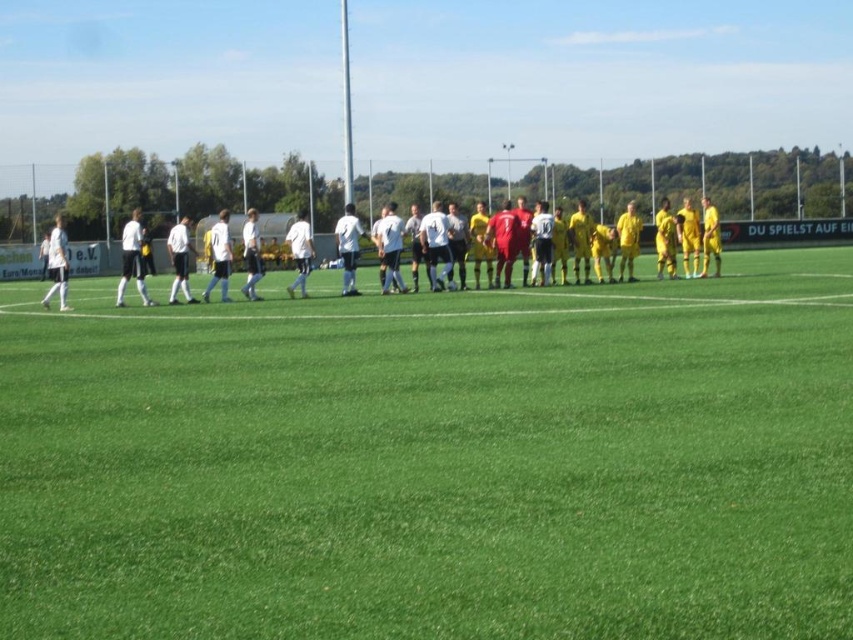
Question: Is green grass field at center bigger than white matte soccer team at center?

Choices:
 (A) no
 (B) yes

Answer: (A)

Question: Does green grass field at center appear under white matte soccer team at center?

Choices:
 (A) no
 (B) yes

Answer: (B)

Question: Can you confirm if green grass field at center is smaller than white matte soccer team at center?

Choices:
 (A) yes
 (B) no

Answer: (A)

Question: Which object appears closest to the camera in this image?

Choices:
 (A) white matte soccer team at center
 (B) green grass field at center

Answer: (B)